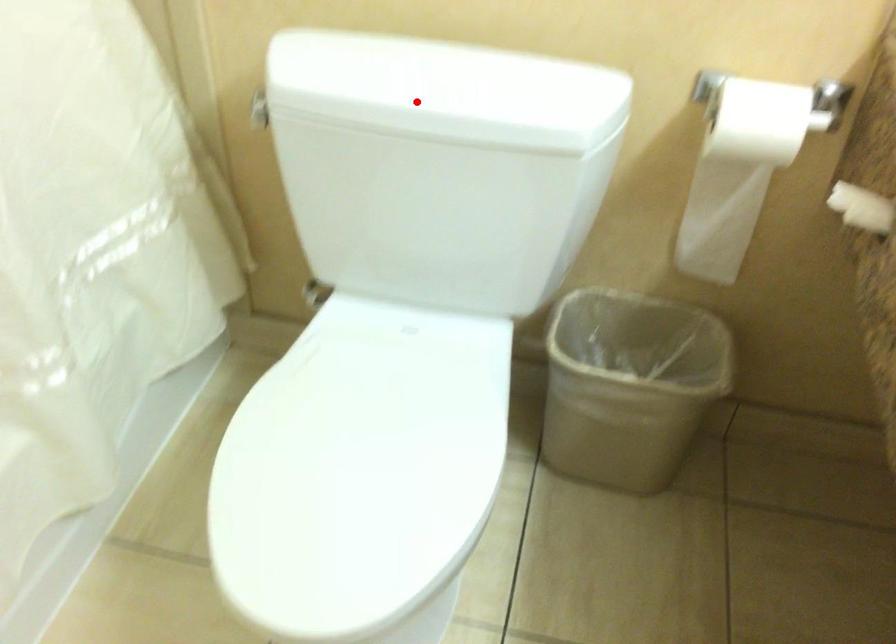
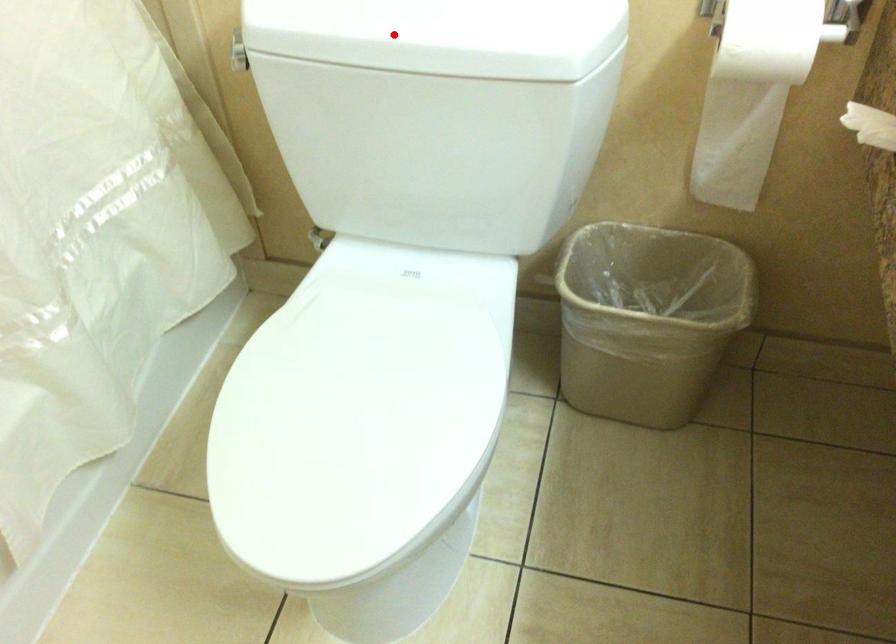
I am providing you with two images of the same scene from different viewpoints. A red point is marked on the first image and another point is marked on the second image. Does the point marked in image1 correspond to the same location as the one in image2?

Yes